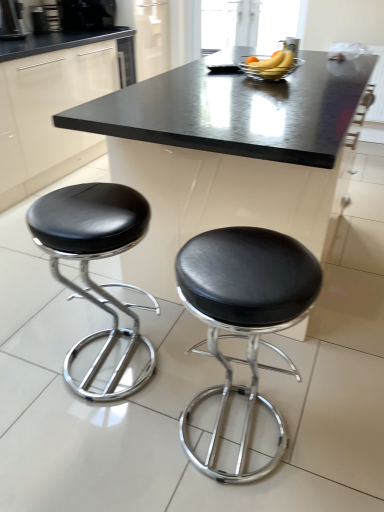
Question: Could you tell me if black plastic coffee machine at upper left, which appears as the 1th coffee machine when viewed from the left, is facing black leather stool at left, the first stool positioned from the left?

Choices:
 (A) no
 (B) yes

Answer: (A)

Question: From the image's perspective, is black plastic coffee machine at upper left, which appears as the 2th coffee machine when viewed from the top, located beneath black leather stool at left, the 2th stool in the right-to-left sequence?

Choices:
 (A) yes
 (B) no

Answer: (B)

Question: From a real-world perspective, is black plastic coffee machine at upper left, which is counted as the second coffee machine, starting from the right, positioned over black leather stool at left, the first stool positioned from the left, based on gravity?

Choices:
 (A) no
 (B) yes

Answer: (B)

Question: Are black plastic coffee machine at upper left, which appears as the 1th coffee machine when viewed from the left, and black leather stool at left, the first stool positioned from the left, beside each other?

Choices:
 (A) yes
 (B) no

Answer: (B)

Question: Is black plastic coffee machine at upper left, which is the first coffee machine in front-to-back order, at the left side of black leather stool at left, the 2th stool in the right-to-left sequence?

Choices:
 (A) no
 (B) yes

Answer: (B)

Question: From the image's perspective, relative to brushed metal coffee maker at upper left, which is the 1th appliance in right-to-left order, is black marble table at center above or below?

Choices:
 (A) below
 (B) above

Answer: (A)

Question: From a real-world perspective, is black marble table at center above or below brushed metal coffee maker at upper left, which is the 1th appliance in right-to-left order?

Choices:
 (A) above
 (B) below

Answer: (B)

Question: Looking at the image, does black marble table at center seem bigger or smaller compared to brushed metal coffee maker at upper left, which is the second appliance from left to right?

Choices:
 (A) big
 (B) small

Answer: (A)

Question: Considering their positions, is black marble table at center located in front of or behind brushed metal coffee maker at upper left, which is the 1th appliance in right-to-left order?

Choices:
 (A) front
 (B) behind

Answer: (A)

Question: Is metallic silver coffee maker at upper left, placed as the 2th appliance when sorted from right to left, to the left or to the right of black plastic coffee machine at upper left, which is counted as the second coffee machine, starting from the right, in the image?

Choices:
 (A) left
 (B) right

Answer: (B)

Question: From the image's perspective, is metallic silver coffee maker at upper left, placed as the 2th appliance when sorted from right to left, located above or below black plastic coffee machine at upper left, which is counted as the 2th coffee machine, starting from the back?

Choices:
 (A) below
 (B) above

Answer: (B)

Question: Is metallic silver coffee maker at upper left, placed as the 2th appliance when sorted from right to left, taller or shorter than black plastic coffee machine at upper left, which appears as the 2th coffee machine when viewed from the top?

Choices:
 (A) tall
 (B) short

Answer: (B)

Question: From a real-world perspective, is metallic silver coffee maker at upper left, placed as the 2th appliance when sorted from right to left, positioned above or below black plastic coffee machine at upper left, which is counted as the second coffee machine, starting from the right?

Choices:
 (A) above
 (B) below

Answer: (B)

Question: Do you think black plastic coffee machine at upper left, the first coffee machine positioned from the bottom, is within black leather stool at lower right, marked as the first stool in a right-to-left arrangement, or outside of it?

Choices:
 (A) outside
 (B) inside

Answer: (A)

Question: Is black plastic coffee machine at upper left, which is counted as the 2th coffee machine, starting from the back, wider or thinner than black leather stool at lower right, marked as the 2th stool in a left-to-right arrangement?

Choices:
 (A) wide
 (B) thin

Answer: (B)